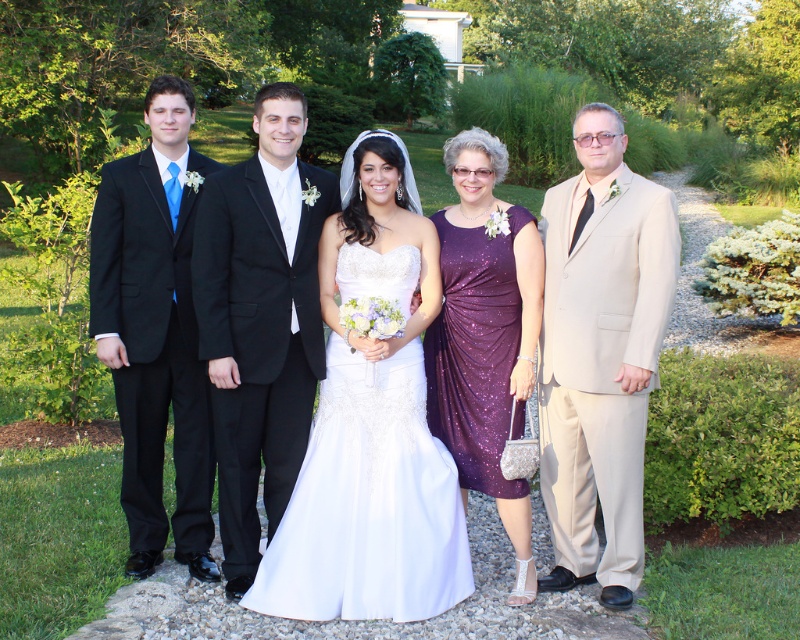
Is beige satin suit at right positioned behind black satin suit at left?

No.

Measure the distance between beige satin suit at right and black satin suit at left.

They are 2.07 meters apart.

Which is behind, point (640, 184) or point (138, 541)?

Point (138, 541)

Find the location of a particular element. This screenshot has height=640, width=800. beige satin suit at right is located at coordinates (600, 353).

Does point (358, 170) lie behind point (141, 330)?

That is True.

Is white satin dress at center bigger than black satin suit at left?

Indeed, white satin dress at center has a larger size compared to black satin suit at left.

Image resolution: width=800 pixels, height=640 pixels. In order to click on white satin dress at center in this screenshot , I will do `click(330, 326)`.

Is the position of beige satin suit at right more distant than that of satin/embroidered dress at center?

No, it is in front of satin/embroidered dress at center.

Image resolution: width=800 pixels, height=640 pixels. What do you see at coordinates (600, 353) in the screenshot?
I see `beige satin suit at right` at bounding box center [600, 353].

Locate an element on the screen. The image size is (800, 640). beige satin suit at right is located at coordinates (600, 353).

At what (x,y) coordinates should I click in order to perform the action: click on beige satin suit at right. Please return your answer as a coordinate pair (x, y). The width and height of the screenshot is (800, 640). Looking at the image, I should click on (600, 353).